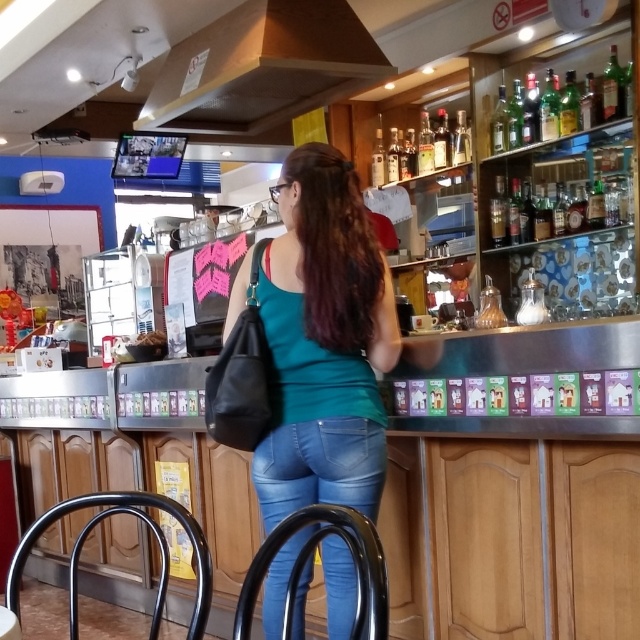
Is point (292, 492) more distant than point (608, 216)?

No, (292, 492) is in front of (608, 216).

This screenshot has width=640, height=640. What are the coordinates of `jeans at center` in the screenshot? It's located at (320, 467).

What do you see at coordinates (320, 467) in the screenshot?
I see `jeans at center` at bounding box center [320, 467].

Identify the location of jeans at center. (320, 467).

Who is positioned more to the left, teal matte tank top at center or jeans at center?

teal matte tank top at center is more to the left.

Which is behind, point (280, 333) or point (280, 472)?

Point (280, 472)

Locate an element on the screen. This screenshot has width=640, height=640. teal matte tank top at center is located at coordinates (324, 340).

Consider the image. Which is below, teal matte tank top at center or translucent glass bottles at upper right?

teal matte tank top at center is below.

Does teal matte tank top at center appear under translucent glass bottles at upper right?

Correct, teal matte tank top at center is located below translucent glass bottles at upper right.

Is point (353, 499) closer to camera compared to point (524, 243)?

Yes, it is.

Locate an element on the screen. The height and width of the screenshot is (640, 640). teal matte tank top at center is located at coordinates (324, 340).